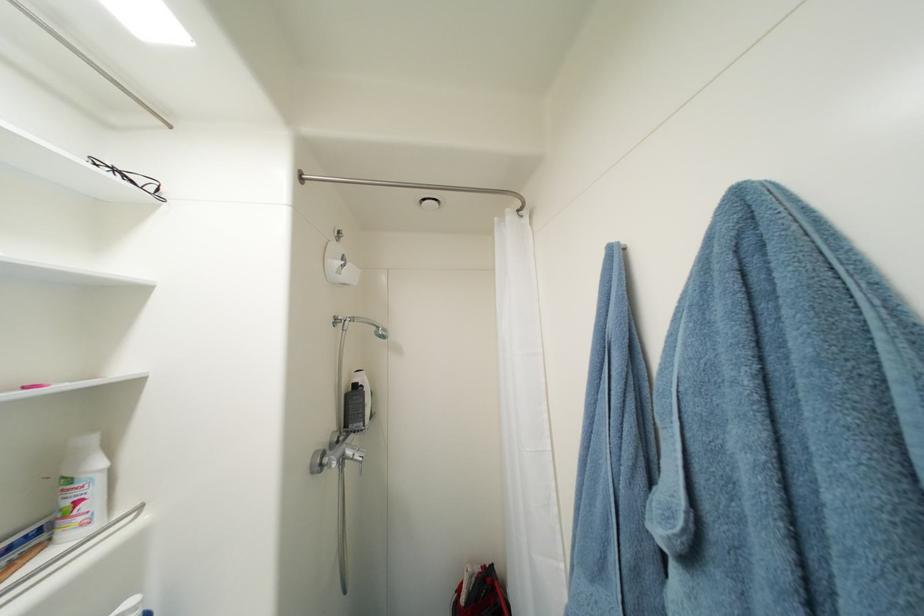
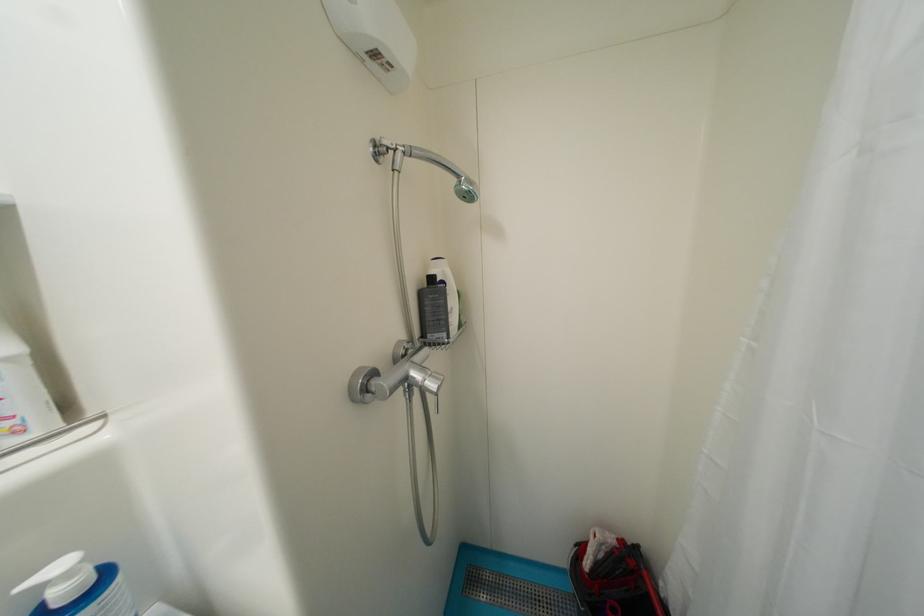
The point at (329, 460) is marked in the first image. Where is the corresponding point in the second image?

(374, 383)